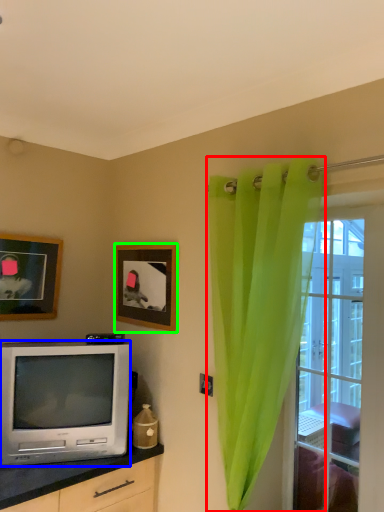
Question: Based on their relative distances, which object is nearer to curtain (highlighted by a red box)? Choose from television (highlighted by a blue box) and picture frame (highlighted by a green box).

Choices:
 (A) television
 (B) picture frame

Answer: (B)